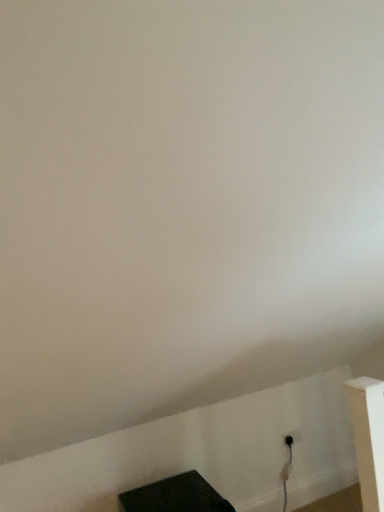
Image resolution: width=384 pixels, height=512 pixels. Find the location of `black plastic outlet at lower right`. black plastic outlet at lower right is located at coordinates point(291,438).

What is the approximate height of black plastic outlet at lower right?

3.69 inches.

Image resolution: width=384 pixels, height=512 pixels. Describe the element at coordinates (291, 438) in the screenshot. I see `black plastic outlet at lower right` at that location.

Describe the element at coordinates (175, 496) in the screenshot. The width and height of the screenshot is (384, 512). I see `black matte tv at lower center` at that location.

This screenshot has width=384, height=512. I want to click on black matte tv at lower center, so click(175, 496).

Identify the location of black plastic outlet at lower right. The image size is (384, 512). (291, 438).

Can you confirm if black plastic outlet at lower right is positioned to the left of black matte tv at lower center?

Incorrect, black plastic outlet at lower right is not on the left side of black matte tv at lower center.

Is black plastic outlet at lower right further to the viewer compared to black matte tv at lower center?

Yes, black plastic outlet at lower right is further from the camera.

Is point (296, 434) closer or farther from the camera than point (190, 474)?

Clearly, point (296, 434) is more distant from the camera than point (190, 474).

From the image's perspective, between black plastic outlet at lower right and black matte tv at lower center, who is located below?

black matte tv at lower center is shown below in the image.

From a real-world perspective, which is physically above, black plastic outlet at lower right or black matte tv at lower center?

black plastic outlet at lower right, from a real-world perspective.

Considering the relative sizes of black plastic outlet at lower right and black matte tv at lower center in the image provided, is black plastic outlet at lower right wider than black matte tv at lower center?

No, black plastic outlet at lower right is not wider than black matte tv at lower center.

From the picture: Is black plastic outlet at lower right shorter than black matte tv at lower center?

Yes.

Which of these two, black plastic outlet at lower right or black matte tv at lower center, is bigger?

Bigger between the two is black matte tv at lower center.

Choose the correct answer: Is black plastic outlet at lower right inside black matte tv at lower center or outside it?

black plastic outlet at lower right is located beyond the bounds of black matte tv at lower center.

From the picture: Is black plastic outlet at lower right not close to black matte tv at lower center?

That's not correct — black plastic outlet at lower right is a little close to black matte tv at lower center.

Is black plastic outlet at lower right turned away from black matte tv at lower center?

black plastic outlet at lower right is not turned away from black matte tv at lower center.

How far apart are black plastic outlet at lower right and black matte tv at lower center?

90.02 centimeters.

Locate an element on the screen. furniture beneath the black plastic outlet at lower right (from a real-world perspective) is located at coordinates tap(175, 496).

Considering the relative positions of black matte tv at lower center and black plastic outlet at lower right in the image provided, is black matte tv at lower center to the left or to the right of black plastic outlet at lower right?

black matte tv at lower center is to the left of black plastic outlet at lower right.

Is black matte tv at lower center in front of black plastic outlet at lower right?

That is True.

Which point is more distant from viewer, (207, 492) or (289, 437)?

The point (289, 437) is farther from the camera.

From the image's perspective, between black matte tv at lower center and black plastic outlet at lower right, which one is located above?

From the image's view, black plastic outlet at lower right is above.

From a real-world perspective, does black matte tv at lower center sit lower than black plastic outlet at lower right?

Yes, from a real-world perspective, black matte tv at lower center is below black plastic outlet at lower right.

From the picture: Considering the relative sizes of black matte tv at lower center and black plastic outlet at lower right in the image provided, is black matte tv at lower center wider than black plastic outlet at lower right?

Indeed, black matte tv at lower center has a greater width compared to black plastic outlet at lower right.

Considering the sizes of objects black matte tv at lower center and black plastic outlet at lower right in the image provided, who is taller, black matte tv at lower center or black plastic outlet at lower right?

Standing taller between the two is black matte tv at lower center.

In the scene shown: Based on their sizes in the image, would you say black matte tv at lower center is bigger or smaller than black plastic outlet at lower right?

In the image, black matte tv at lower center appears to be larger than black plastic outlet at lower right.

Can black plastic outlet at lower right be found inside black matte tv at lower center?

No, black plastic outlet at lower right is not surrounded by black matte tv at lower center.

Does black matte tv at lower center touch black plastic outlet at lower right?

No, black matte tv at lower center is not beside black plastic outlet at lower right.

Is black matte tv at lower center oriented towards black plastic outlet at lower right?

No, black matte tv at lower center is not turned towards black plastic outlet at lower right.

How many degrees apart are the facing directions of black matte tv at lower center and black plastic outlet at lower right?

0.00413 degrees separate the facing orientations of black matte tv at lower center and black plastic outlet at lower right.

Locate an element on the screen. electric outlet behind the black matte tv at lower center is located at coordinates (291, 438).

The height and width of the screenshot is (512, 384). In order to click on furniture below the black plastic outlet at lower right (from the image's perspective) in this screenshot , I will do pos(175,496).

I want to click on furniture lying on the left of black plastic outlet at lower right, so click(175, 496).